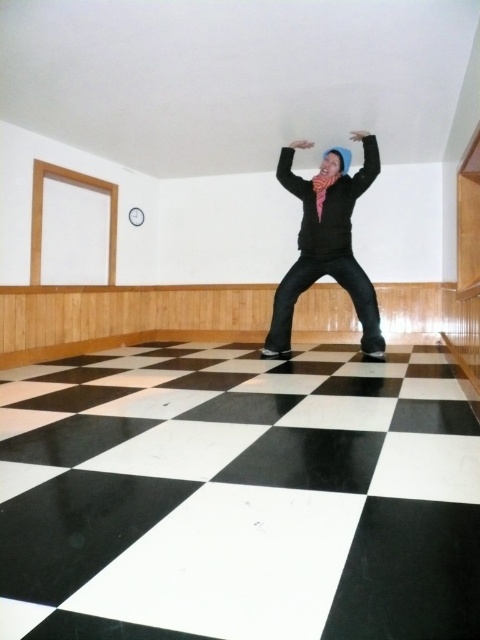
Question: Which of the following is the closest to the observer?

Choices:
 (A) (334, 208)
 (B) (374, 177)

Answer: (B)

Question: Is matte black hoodie at center to the right of matte black arm at upper center from the viewer's perspective?

Choices:
 (A) no
 (B) yes

Answer: (B)

Question: Does matte black hoodie at center come behind matte black arm at upper center?

Choices:
 (A) yes
 (B) no

Answer: (B)

Question: Is matte black hoodie at center positioned behind matte black arm at upper center?

Choices:
 (A) no
 (B) yes

Answer: (A)

Question: Which object is the closest to the black matte arm at upper center?

Choices:
 (A) matte black hoodie at center
 (B) matte black arm at upper center

Answer: (A)

Question: Which object is farther from the camera taking this photo?

Choices:
 (A) matte black arm at upper center
 (B) matte black hoodie at center
 (C) black matte arm at upper center

Answer: (A)